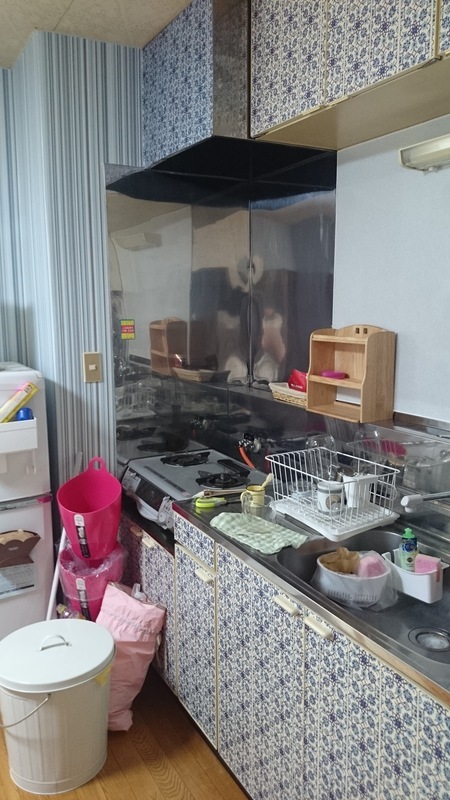
Find the location of a particular element. This screenshot has width=450, height=800. cups is located at coordinates (254, 490), (332, 498).